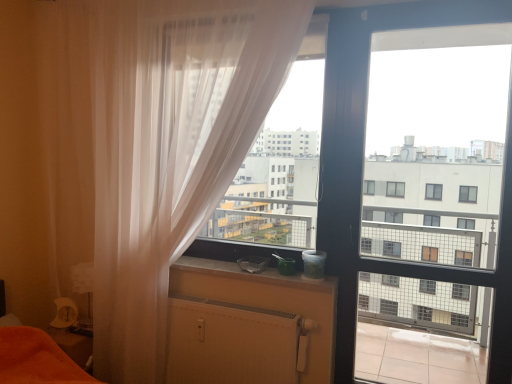
Question: From a real-world perspective, is translucent white curtain at left physically located above or below smooth concrete window sill at center?

Choices:
 (A) below
 (B) above

Answer: (B)

Question: Which is correct: translucent white curtain at left is inside smooth concrete window sill at center, or outside of it?

Choices:
 (A) outside
 (B) inside

Answer: (A)

Question: Which object is the farthest from the smooth concrete window sill at center?

Choices:
 (A) transparent plastic window screen at center
 (B) translucent white curtain at left
 (C) transparent glass screen door at center
 (D) white matte radiator at lower center

Answer: (C)

Question: Which of these objects is positioned closest to the translucent white curtain at left?

Choices:
 (A) transparent glass screen door at center
 (B) white matte radiator at lower center
 (C) transparent plastic window screen at center
 (D) smooth concrete window sill at center

Answer: (C)